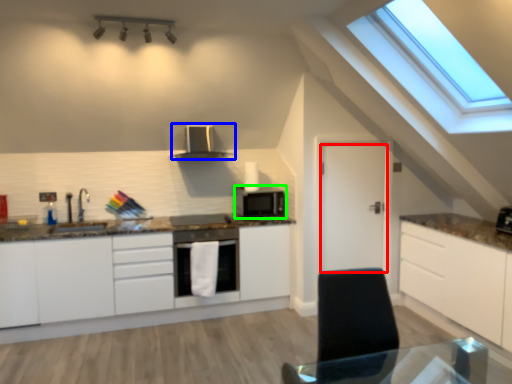
Question: Which is nearer to the door (highlighted by a red box)? kitchen appliance (highlighted by a blue box) or microwave oven (highlighted by a green box).

Choices:
 (A) kitchen appliance
 (B) microwave oven

Answer: (B)